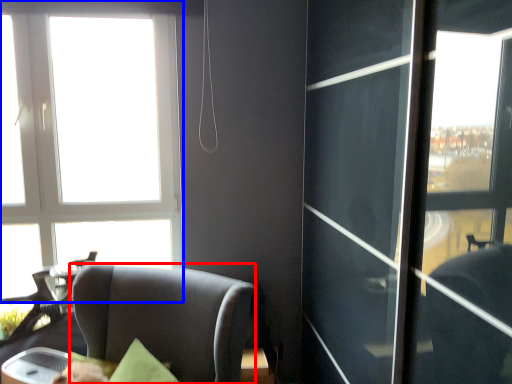
Question: Which of the following is the closest to the observer, chair (highlighted by a red box) or window (highlighted by a blue box)?

Choices:
 (A) chair
 (B) window

Answer: (A)